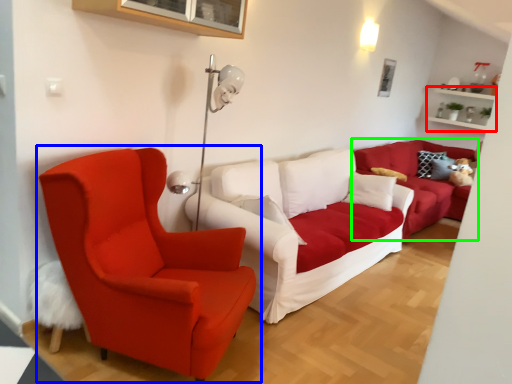
Question: Considering the real-world distances, which object is closest to shelf (highlighted by a red box)? chair (highlighted by a blue box) or studio couch (highlighted by a green box).

Choices:
 (A) chair
 (B) studio couch

Answer: (B)